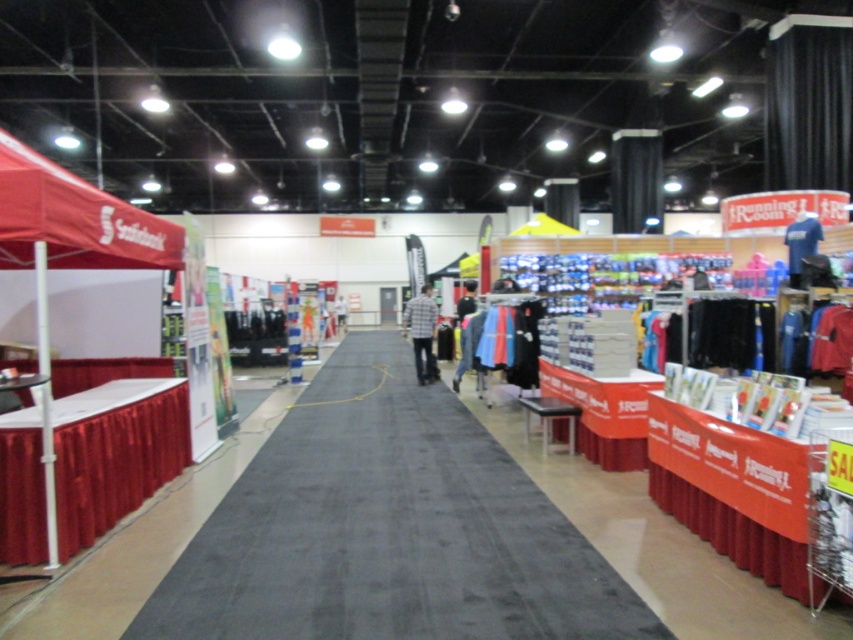
Question: Which point appears farthest from the camera in this image?

Choices:
 (A) (370, 420)
 (B) (157, 227)
 (C) (807, 236)
 (D) (462, 324)

Answer: (D)

Question: Which object is closer to the camera taking this photo?

Choices:
 (A) black carpet at center
 (B) plaid fabric shirt at center
 (C) blue jersey at center
 (D) dark blue fabric shirt at center

Answer: (A)

Question: Where is red fabric canopy at upper left located in relation to blue jersey at center in the image?

Choices:
 (A) left
 (B) right

Answer: (A)

Question: Can you confirm if black carpet at center is positioned above dark blue fabric shirt at center?

Choices:
 (A) yes
 (B) no

Answer: (B)

Question: Can you confirm if red fabric canopy at upper left is positioned to the right of plaid fabric shirt at center?

Choices:
 (A) yes
 (B) no

Answer: (B)

Question: Among these points, which one is farthest from the camera?

Choices:
 (A) (85, 195)
 (B) (434, 312)

Answer: (B)